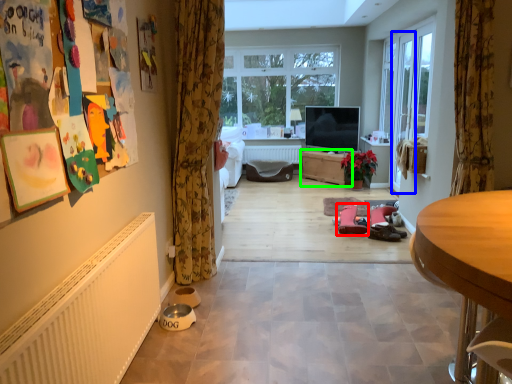
Question: Considering the real-world distances, which object is farthest from footwear (highlighted by a red box)? screen door (highlighted by a blue box) or cabinetry (highlighted by a green box)?

Choices:
 (A) screen door
 (B) cabinetry

Answer: (B)